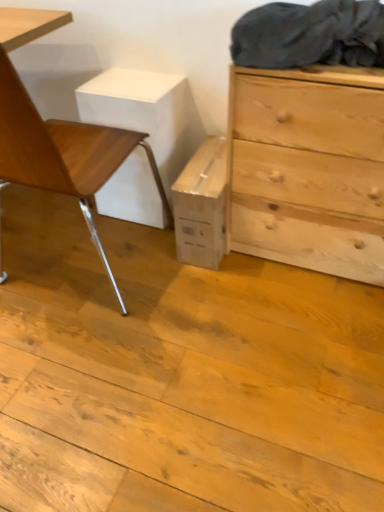
Question: Is wooden chair at left inside dark gray fabric at upper right?

Choices:
 (A) no
 (B) yes

Answer: (A)

Question: Does dark gray fabric at upper right have a greater width compared to wooden chair at left?

Choices:
 (A) no
 (B) yes

Answer: (A)

Question: Considering the relative sizes of dark gray fabric at upper right and wooden chair at left in the image provided, is dark gray fabric at upper right thinner than wooden chair at left?

Choices:
 (A) yes
 (B) no

Answer: (A)

Question: Does dark gray fabric at upper right come in front of wooden chair at left?

Choices:
 (A) no
 (B) yes

Answer: (A)

Question: Is dark gray fabric at upper right next to wooden chair at left?

Choices:
 (A) no
 (B) yes

Answer: (A)

Question: From the image's perspective, is dark gray fabric at upper right above wooden chair at left?

Choices:
 (A) yes
 (B) no

Answer: (A)

Question: From the image's perspective, is natural wood chest of drawers at right beneath wooden chair at left?

Choices:
 (A) no
 (B) yes

Answer: (B)

Question: Is natural wood chest of drawers at right aimed at wooden chair at left?

Choices:
 (A) yes
 (B) no

Answer: (B)

Question: Is natural wood chest of drawers at right shorter than wooden chair at left?

Choices:
 (A) yes
 (B) no

Answer: (A)

Question: From a real-world perspective, is natural wood chest of drawers at right located higher than wooden chair at left?

Choices:
 (A) no
 (B) yes

Answer: (A)

Question: Is wooden chair at left at the back of natural wood chest of drawers at right?

Choices:
 (A) yes
 (B) no

Answer: (B)

Question: Is natural wood chest of drawers at right taller than wooden chair at left?

Choices:
 (A) no
 (B) yes

Answer: (A)

Question: Is wooden chair at left not close to dark gray fabric at upper right?

Choices:
 (A) no
 (B) yes

Answer: (A)